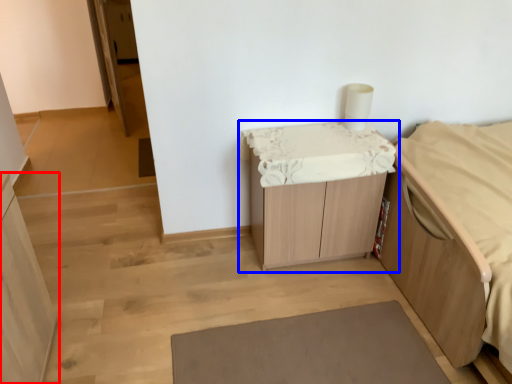
Question: Which object is further to the camera taking this photo, cabinetry (highlighted by a red box) or table (highlighted by a blue box)?

Choices:
 (A) cabinetry
 (B) table

Answer: (B)